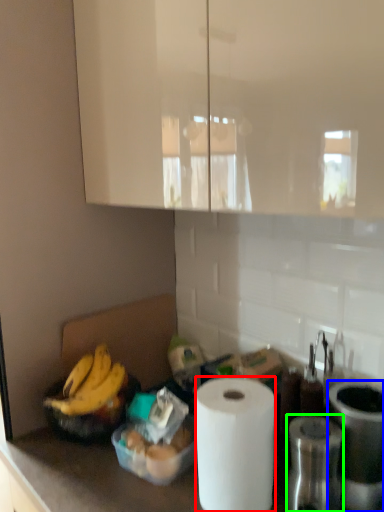
Question: Based on their relative distances, which object is farther from paper towel (highlighted by a red box)? Choose from appliance (highlighted by a blue box) and appliance (highlighted by a green box).

Choices:
 (A) appliance
 (B) appliance

Answer: (A)